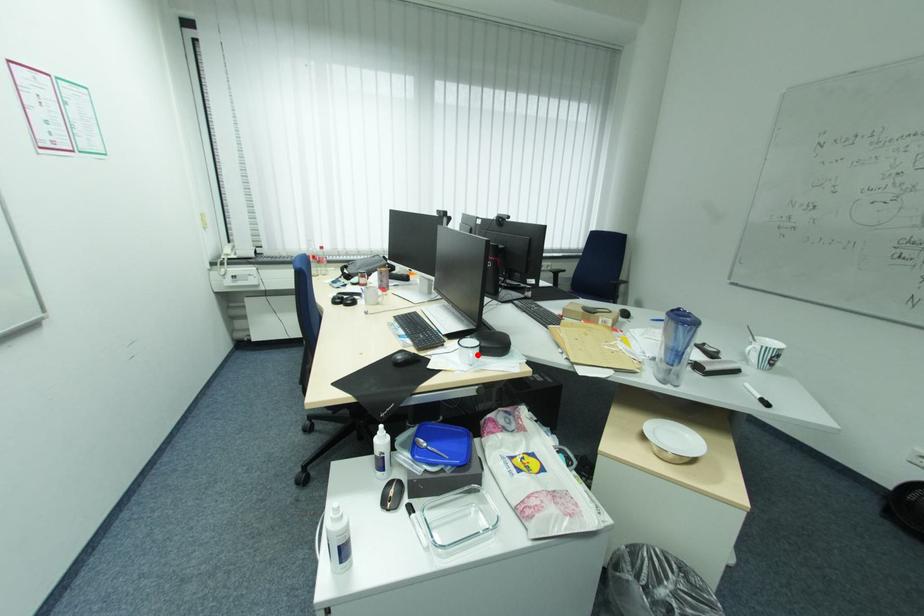
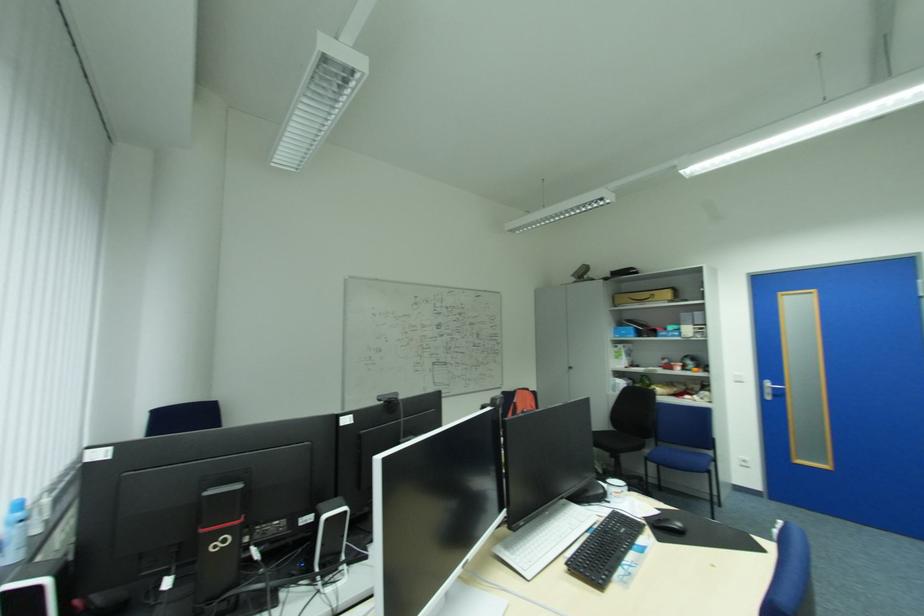
Find the pixel in the second image that matches the highlighted location in the first image.

(631, 485)